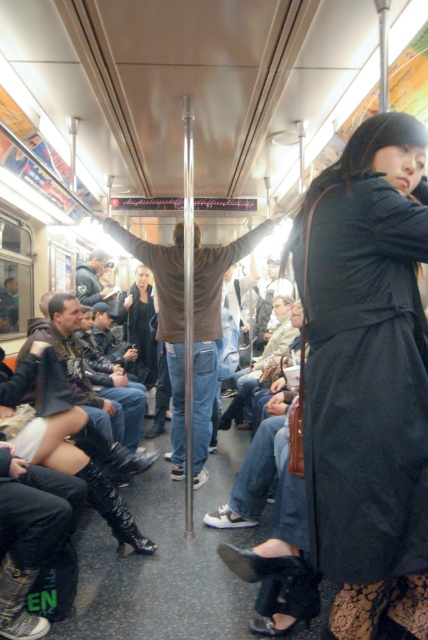
Question: Does black matte coat at center come behind brown leather jacket at center?

Choices:
 (A) yes
 (B) no

Answer: (B)

Question: Which of the following is the closest to the observer?

Choices:
 (A) brown leather jacket at center
 (B) black matte coat at center

Answer: (B)

Question: Does black matte coat at center have a lesser width compared to brown leather jacket at center?

Choices:
 (A) yes
 (B) no

Answer: (A)

Question: Observing the image, what is the correct spatial positioning of black matte coat at center in reference to brown leather jacket at center?

Choices:
 (A) left
 (B) right

Answer: (B)

Question: Which point appears farthest from the camera in this image?

Choices:
 (A) (160, 253)
 (B) (413, 300)

Answer: (A)